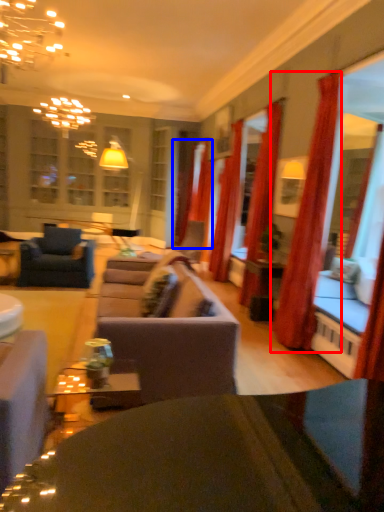
Question: Which object is further to the camera taking this photo, curtain (highlighted by a red box) or curtain (highlighted by a blue box)?

Choices:
 (A) curtain
 (B) curtain

Answer: (B)